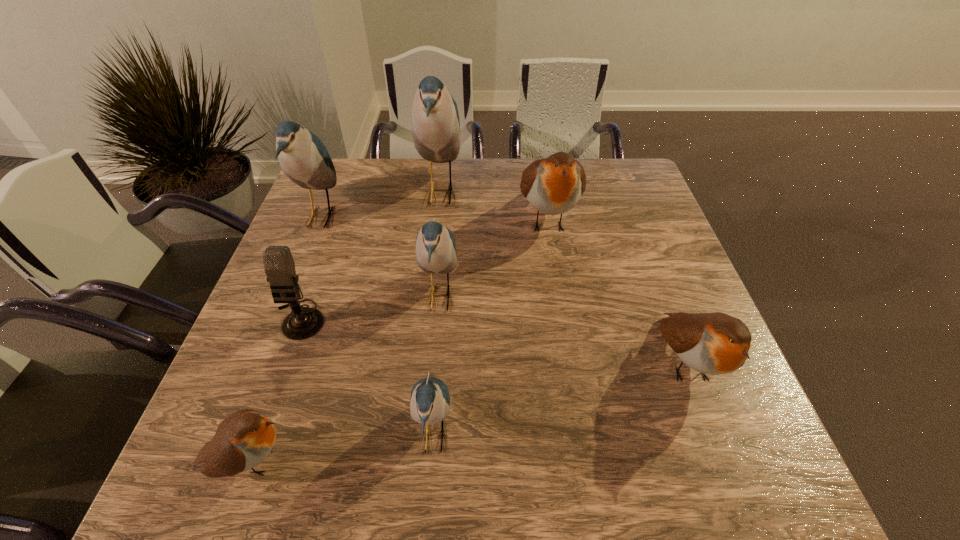
Image resolution: width=960 pixels, height=540 pixels. What are the coordinates of `the biggest blue bird` in the screenshot? It's located at (435, 119).

Locate an element on the screen. the tallest bird is located at coordinates (435, 119).

Locate an element on the screen. This screenshot has height=540, width=960. the second tallest bird is located at coordinates (303, 157).

Where is `the leftmost blue bird`? the leftmost blue bird is located at coordinates (303, 157).

The width and height of the screenshot is (960, 540). Identify the location of the second brown bird from left to right. (553, 185).

I want to click on the farthest brown bird, so click(x=553, y=185).

Where is `the second smallest blue bird`? The width and height of the screenshot is (960, 540). the second smallest blue bird is located at coordinates [x=435, y=253].

Locate an element on the screen. microphone is located at coordinates (303, 322).

Find the location of a particular element. This screenshot has height=540, width=960. the second farthest brown bird is located at coordinates coord(715,343).

You are a GUI agent. You are given a task and a screenshot of the screen. Output one action in this format:
    pyautogui.click(x=<x>, y=<y>)
    Task: Click on the second smallest brown bird
    Image resolution: width=960 pixels, height=540 pixels.
    Given the screenshot: What is the action you would take?
    pyautogui.click(x=715, y=343)